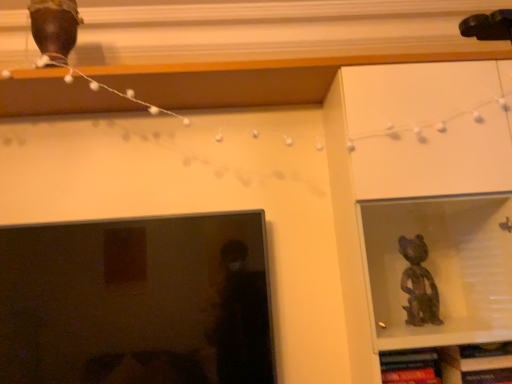
Question: Considering the positions of wooden bookshelf at lower right and matte black tv at left in the image, is wooden bookshelf at lower right taller or shorter than matte black tv at left?

Choices:
 (A) tall
 (B) short

Answer: (B)

Question: Is point (420, 374) positioned closer to the camera than point (104, 345)?

Choices:
 (A) farther
 (B) closer

Answer: (A)

Question: From the image's perspective, relative to matte black tv at left, is wooden bookshelf at lower right above or below?

Choices:
 (A) above
 (B) below

Answer: (B)

Question: From a real-world perspective, is matte black tv at left above or below wooden bookshelf at lower right?

Choices:
 (A) below
 (B) above

Answer: (B)

Question: Looking at their shapes, would you say matte black tv at left is wider or thinner than wooden bookshelf at lower right?

Choices:
 (A) wide
 (B) thin

Answer: (B)

Question: Would you say matte black tv at left is inside or outside wooden bookshelf at lower right?

Choices:
 (A) inside
 (B) outside

Answer: (B)

Question: Does point (190, 243) appear closer or farther from the camera than point (507, 365)?

Choices:
 (A) farther
 (B) closer

Answer: (A)